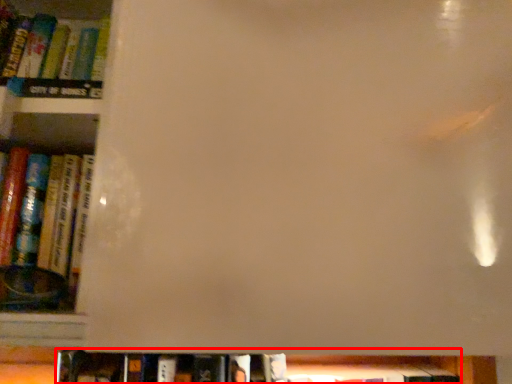
Question: Considering the relative positions of book (annotated by the red box) and book in the image provided, where is book (annotated by the red box) located with respect to the staircase?

Choices:
 (A) left
 (B) right

Answer: (B)